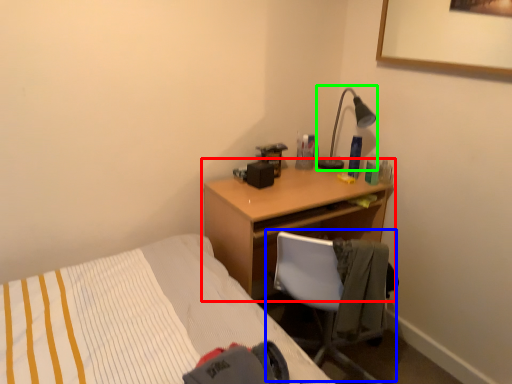
Question: Estimate the real-world distances between objects in this image. Which object is farther from desk (highlighted by a red box), chair (highlighted by a blue box) or lamp (highlighted by a green box)?

Choices:
 (A) chair
 (B) lamp

Answer: (B)